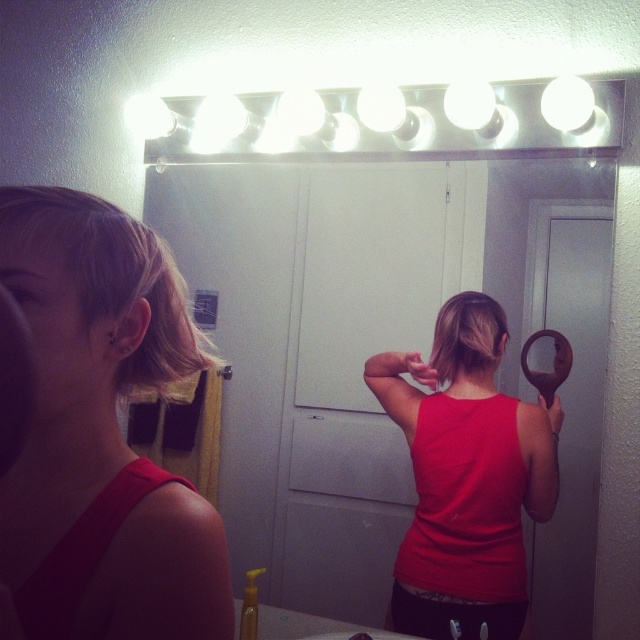
Question: In this image, where is matte red tank top at center located relative to blonde hair at left?

Choices:
 (A) right
 (B) left

Answer: (A)

Question: Is matte red tank top at center bigger than blondehair at center?

Choices:
 (A) no
 (B) yes

Answer: (B)

Question: Does matte plastic mirror at center have a smaller size compared to matte red tank top at center?

Choices:
 (A) yes
 (B) no

Answer: (B)

Question: Which point is farther from the camera taking this photo?

Choices:
 (A) (452, 337)
 (B) (122, 266)
 (C) (561, 410)

Answer: (A)

Question: Which point is closer to the camera taking this photo?

Choices:
 (A) (100, 282)
 (B) (147, 292)
 (C) (458, 308)
 (D) (483, 566)

Answer: (A)

Question: Which object is farther from the camera taking this photo?

Choices:
 (A) matte plastic mirror at center
 (B) blonde hair at left

Answer: (A)